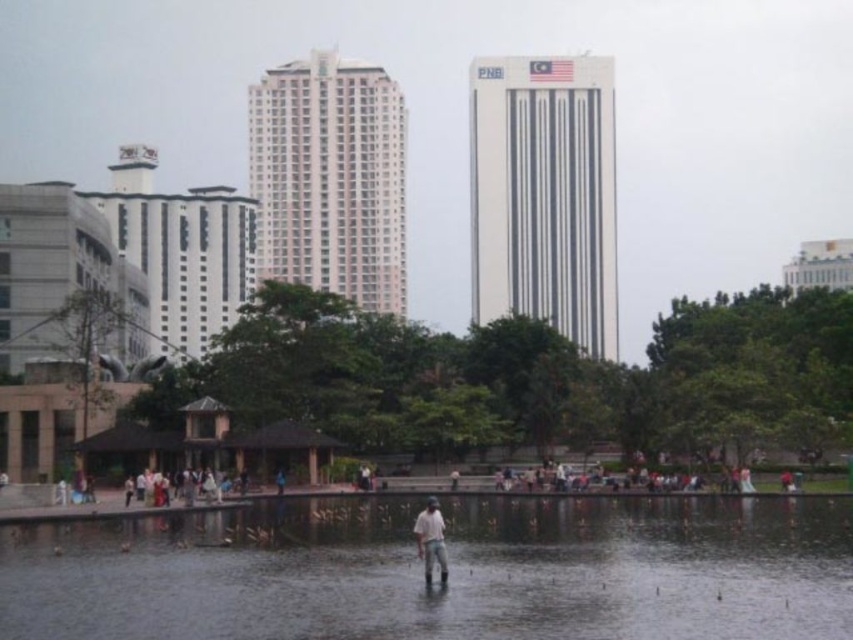
You are a drone operator who needs to capture a photo of the transparent water at center from above. The drone must hover exactly at the 2D coordinates provided in the scene description. What coordinates should the drone be set to hover at?

The transparent water at center should be captured by hovering the drone at coordinates point (437, 572) as specified in the Objects Description.

You are a photographer planning to capture a reflection of the Malaysian flag on the water. You see the transparent water at center and the light brown fabric shirt at center. Which object should you focus on to ensure you capture the reflection properly?

You should focus on the transparent water at center because it is to the left of the light brown fabric shirt at center, making it the ideal surface for capturing the reflection of the Malaysian flag.

You are standing in the urban park scene described, and you want to reach the point marked at coordinates (531, 506). Considering the distance, can you walk directly to this point without any obstacles?

The point at coordinates (531, 506) is 73.35 meters away from the viewer. Since there are no obstacles mentioned in the scene description, you can walk directly to this point.